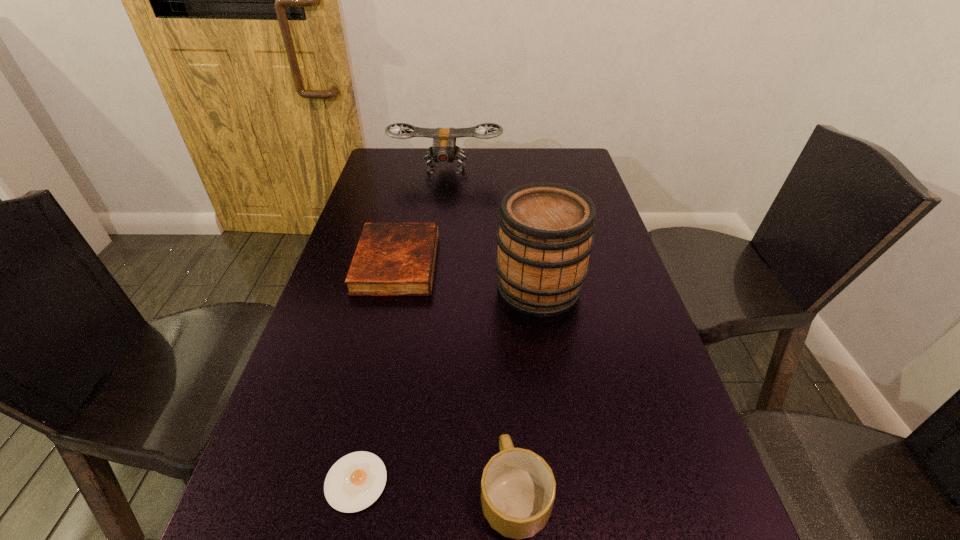
The width and height of the screenshot is (960, 540). I want to click on the tallest object, so click(x=545, y=236).

Find the location of a particular element. drone is located at coordinates (444, 150).

The width and height of the screenshot is (960, 540). In order to click on the second tallest object in this screenshot , I will do `click(444, 150)`.

The width and height of the screenshot is (960, 540). In order to click on Bible in this screenshot , I will do `click(391, 259)`.

The width and height of the screenshot is (960, 540). Identify the location of the shortest object. (354, 482).

Where is `vacant space located 0.380m on the back of the tallest object`? The image size is (960, 540). vacant space located 0.380m on the back of the tallest object is located at coordinates (524, 190).

The image size is (960, 540). I want to click on free space located 0.330m on the front-facing side of the farthest object, so pos(437,240).

Locate an element on the screen. The width and height of the screenshot is (960, 540). vacant space located 0.250m on the spine side of the second shortest object is located at coordinates (528, 263).

You are a GUI agent. You are given a task and a screenshot of the screen. Output one action in this format:
    pyautogui.click(x=<x>, y=<y>)
    Task: Click on the free point located 0.290m on the right of the egg yolk
    The image size is (960, 540).
    Given the screenshot: What is the action you would take?
    pyautogui.click(x=558, y=482)

Where is `object that is at the far edge`? This screenshot has width=960, height=540. object that is at the far edge is located at coordinates (444, 150).